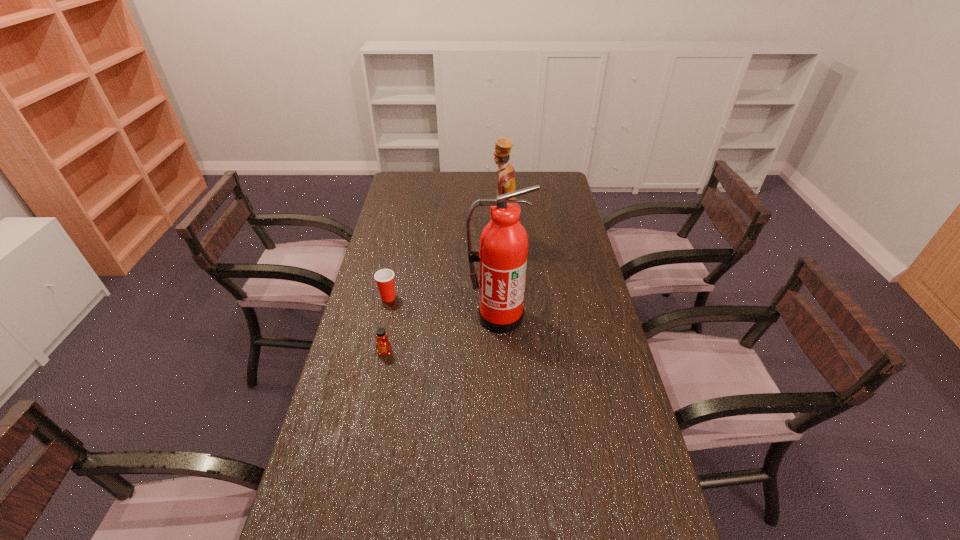
The image size is (960, 540). I want to click on Dixie cup that is at the left edge, so click(x=384, y=278).

This screenshot has height=540, width=960. I want to click on honey that is at the left edge, so click(383, 346).

This screenshot has width=960, height=540. Identify the location of vacant area at the far edge. (516, 178).

At what (x,y) coordinates should I click in order to perform the action: click on free space at the left edge of the desktop. Please return your answer as a coordinate pair (x, y). This screenshot has height=540, width=960. Looking at the image, I should click on (344, 348).

Locate an element on the screen. The height and width of the screenshot is (540, 960). vacant space at the right edge of the desktop is located at coordinates (586, 259).

The height and width of the screenshot is (540, 960). In order to click on vacant space at the far left corner in this screenshot , I will do `click(424, 180)`.

The height and width of the screenshot is (540, 960). What are the coordinates of `vacant space in between the Dixie cup and the fire extinguisher` in the screenshot? It's located at (x=444, y=307).

The width and height of the screenshot is (960, 540). In order to click on free space that is in between the Dixie cup and the nearest object in this screenshot , I will do `click(387, 325)`.

Locate an element on the screen. The image size is (960, 540). free point between the nearest object and the fire extinguisher is located at coordinates (442, 335).

Identify the location of vacant area between the farthest object and the nearest object. (444, 300).